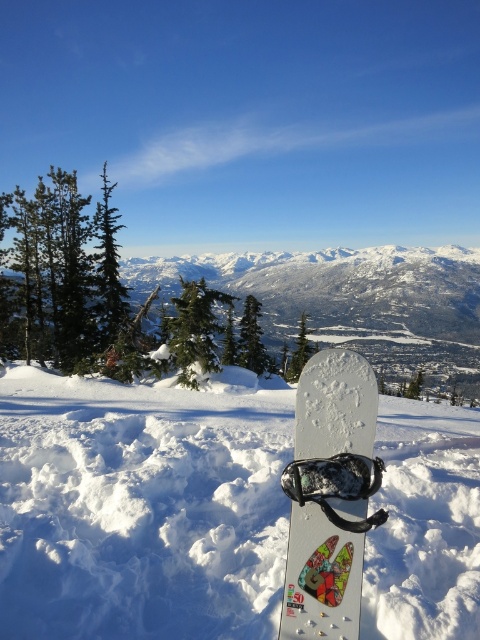
Question: Which of the following is the farthest from the observer?

Choices:
 (A) (314, 260)
 (B) (112, 292)

Answer: (A)

Question: Is snowy white mountain at center below white glossy snowboard at center?

Choices:
 (A) yes
 (B) no

Answer: (B)

Question: Which object is positioned farthest from the white matte snowboard at center?

Choices:
 (A) white glossy snowboard at center
 (B) green matte pine at upper left

Answer: (B)

Question: Estimate the real-world distances between objects in this image. Which object is closer to the green matte pine at upper left?

Choices:
 (A) white matte snowboard at center
 (B) snowy white mountain at center
 (C) white glossy snowboard at center

Answer: (A)

Question: In this image, where is white matte snowboard at center located relative to white glossy snowboard at center?

Choices:
 (A) below
 (B) above

Answer: (A)

Question: Can you confirm if snowy white mountain at center is smaller than white glossy snowboard at center?

Choices:
 (A) yes
 (B) no

Answer: (B)